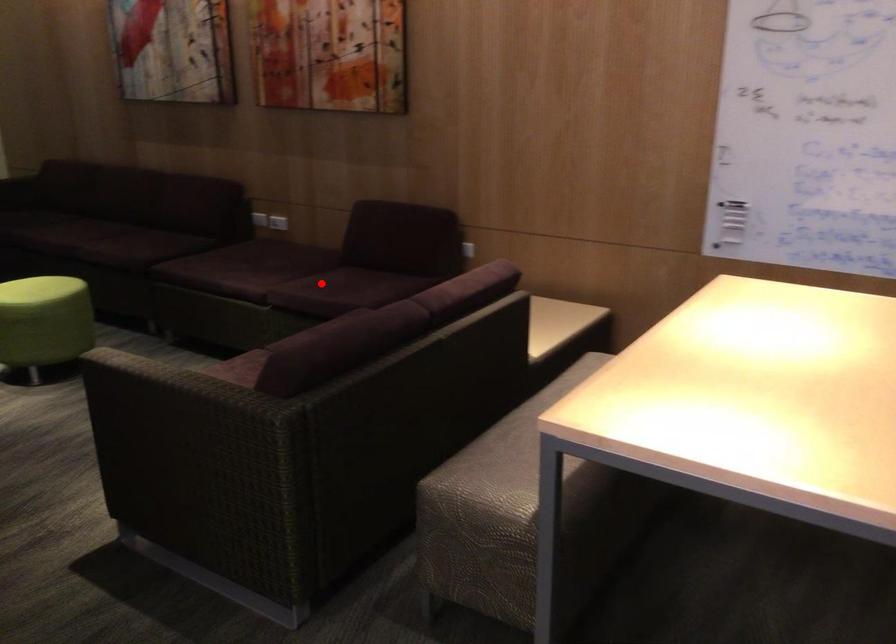
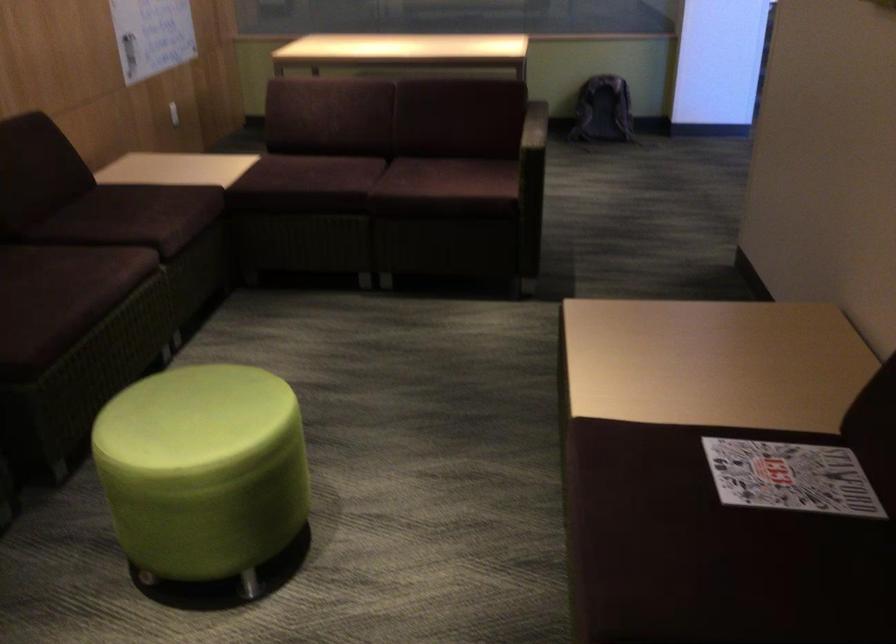
In the second image, find the point that corresponds to the highlighted location in the first image.

(147, 214)